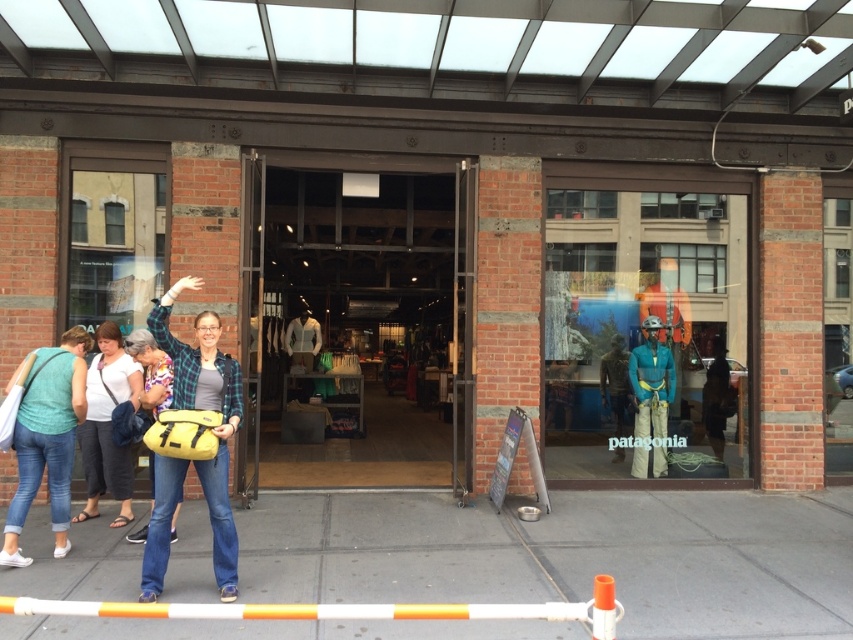
Question: In this image, where is blue fabric mannequin at center located relative to matte teal t-shirt at lower left?

Choices:
 (A) above
 (B) below

Answer: (A)

Question: Considering the real-world distances, which object is closest to the yellow fabric backpack at center?

Choices:
 (A) blue fabric mannequin at center
 (B) matte yellow backpack at center
 (C) gray concrete pavement at lower center

Answer: (C)

Question: Which point appears closest to the camera in this image?

Choices:
 (A) (222, 563)
 (B) (115, 486)

Answer: (A)

Question: Does gray concrete pavement at lower center lie in front of blue fabric mannequin at center?

Choices:
 (A) yes
 (B) no

Answer: (A)

Question: Does blue fabric mannequin at center appear over yellow fabric backpack at center?

Choices:
 (A) yes
 (B) no

Answer: (A)

Question: Which object is positioned farthest from the matte yellow backpack at center?

Choices:
 (A) gray concrete pavement at lower center
 (B) matte teal t-shirt at lower left
 (C) blue fabric mannequin at center
 (D) yellow fabric backpack at center

Answer: (C)